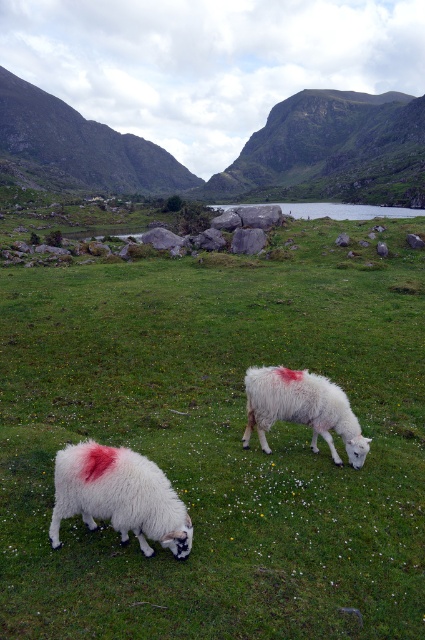
Question: Which point is closer to the camera taking this photo?

Choices:
 (A) (42, 177)
 (B) (173, 506)
 (C) (56, 166)

Answer: (B)

Question: Considering the relative positions of white woolen sheep at center and green smooth water at center in the image provided, where is white woolen sheep at center located with respect to green smooth water at center?

Choices:
 (A) below
 (B) above

Answer: (A)

Question: Which object is the closest to the white woolen sheep at center?

Choices:
 (A) green smooth water at center
 (B) white woolly sheep at center
 (C) rocky brown hillside at upper left
 (D) green grassy hillside at upper center

Answer: (B)

Question: Does white woolly sheep at center lie in front of green smooth water at center?

Choices:
 (A) yes
 (B) no

Answer: (A)

Question: Can you confirm if green grassy hillside at upper center is positioned below green smooth water at center?

Choices:
 (A) yes
 (B) no

Answer: (B)

Question: Estimate the real-world distances between objects in this image. Which object is farther from the rocky brown hillside at upper left?

Choices:
 (A) white woolen sheep at center
 (B) white woolly sheep at center

Answer: (B)